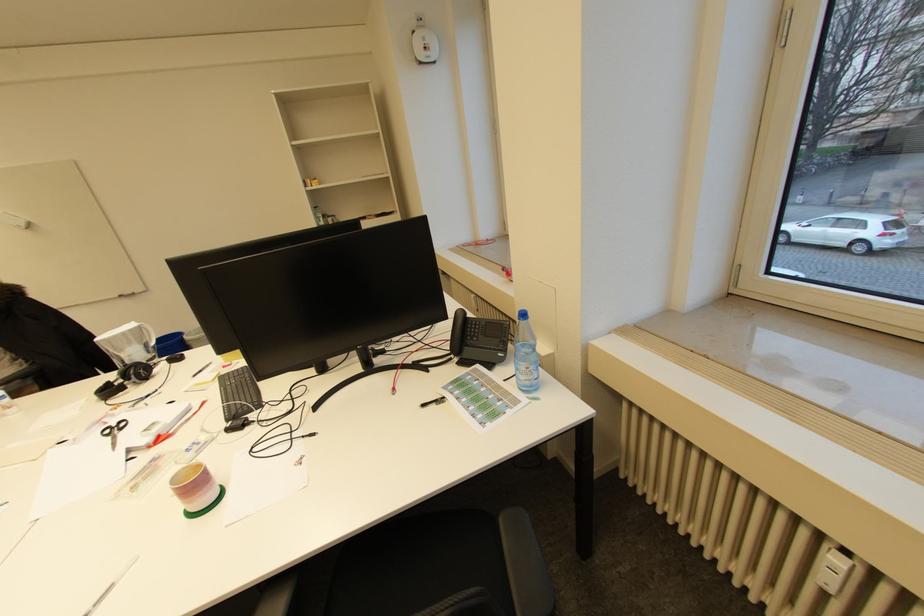
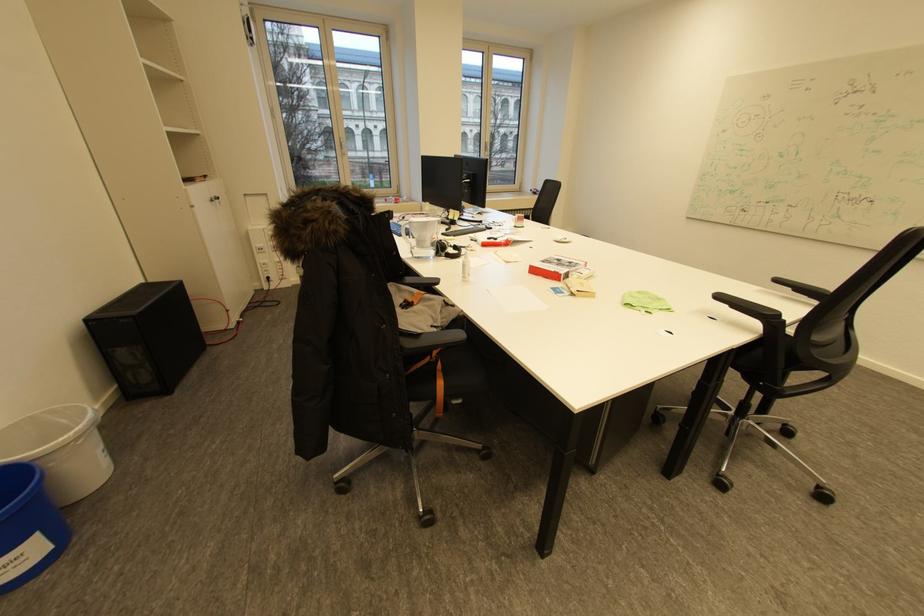
Question: I am providing you with two images of the same scene from different viewpoints. Please identify which objects are invisible in image2.

Choices:
 (A) white spray bottle
 (B) glass water pitcher
 (C) purple container
 (D) black pen

Answer: (D)